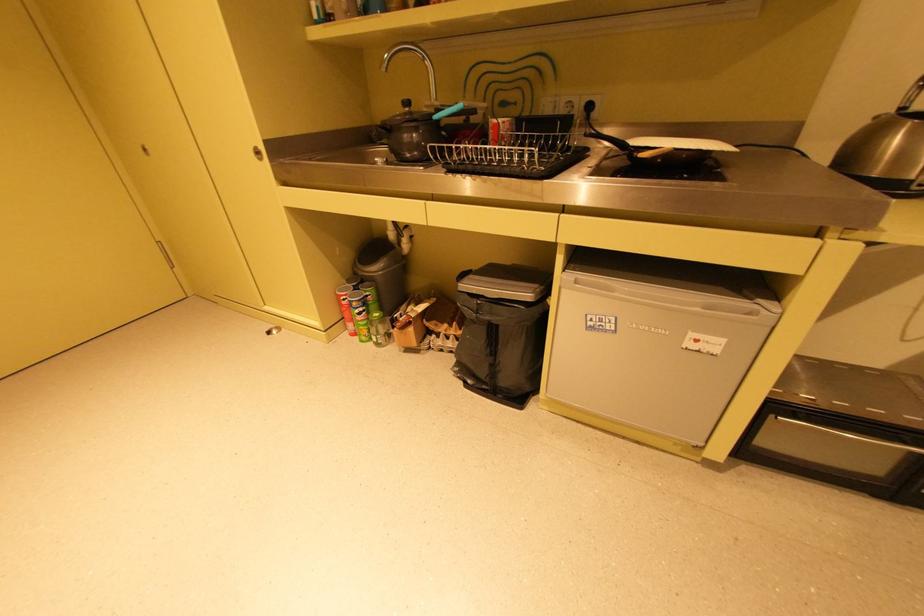
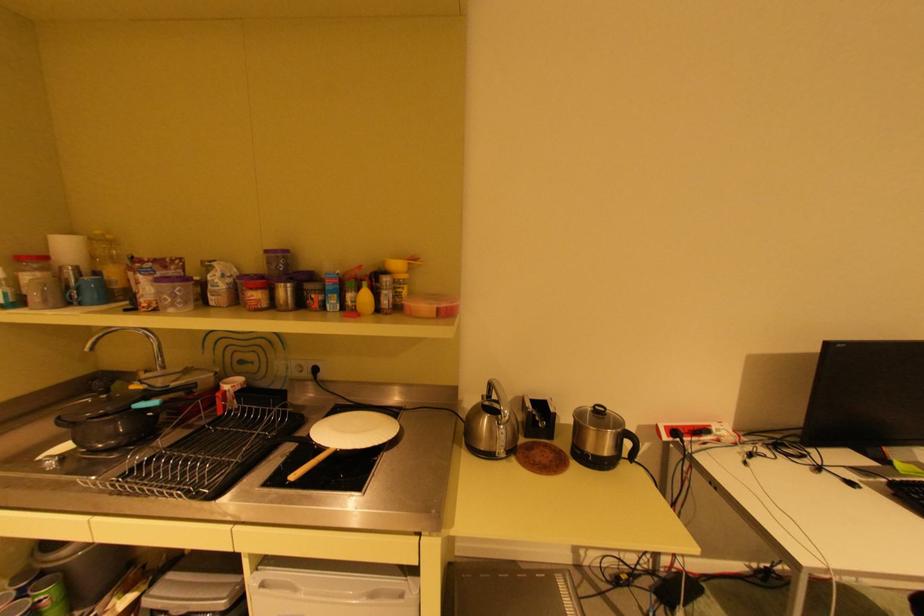
Where in the second image is the point corresponding to [439,119] from the first image?

(139, 408)